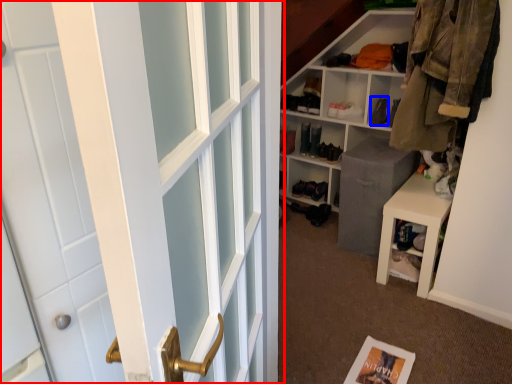
Question: Among these objects, which one is farthest to the camera, door (highlighted by a red box) or shoe (highlighted by a blue box)?

Choices:
 (A) door
 (B) shoe

Answer: (B)